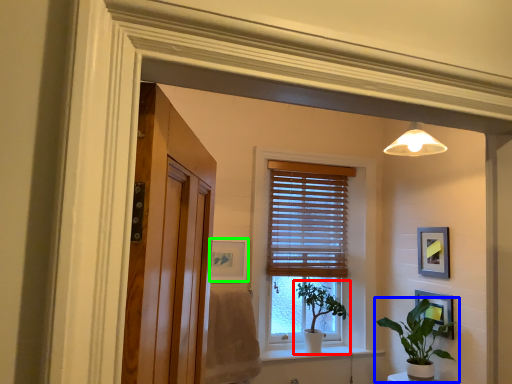
Question: Estimate the real-world distances between objects in this image. Which object is closer to houseplant (highlighted by a red box), houseplant (highlighted by a blue box) or picture frame (highlighted by a green box)?

Choices:
 (A) houseplant
 (B) picture frame

Answer: (A)